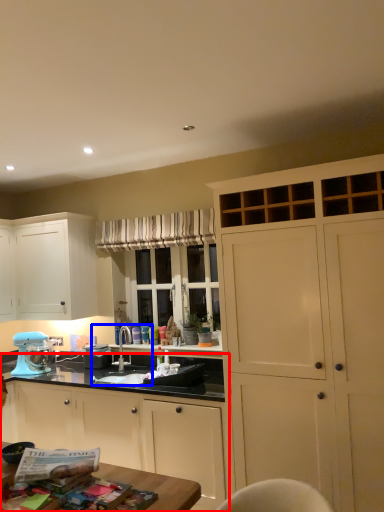
Question: Which of the following is the farthest to the observer, cabinetry (highlighted by a red box) or sink (highlighted by a blue box)?

Choices:
 (A) cabinetry
 (B) sink

Answer: (B)